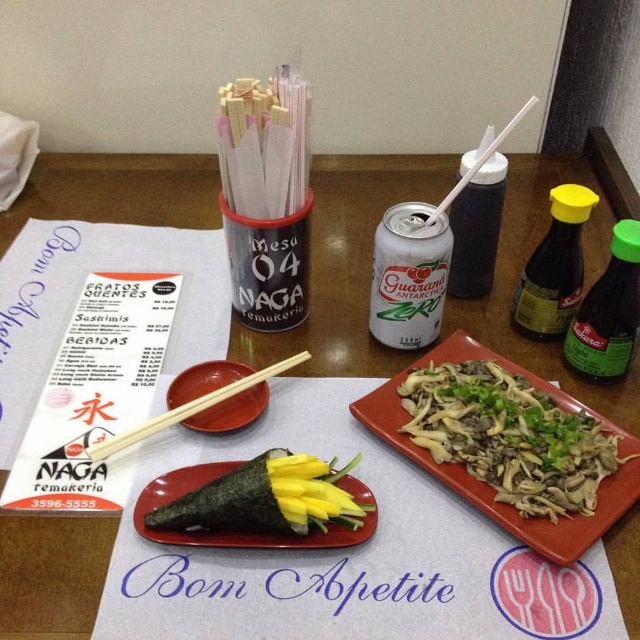
Question: Which object is the farthest from the white matte can at center?

Choices:
 (A) green glass soy sauce at right
 (B) matte wood chopsticks at center

Answer: (B)

Question: Observing the image, what is the correct spatial positioning of green leafy vegetables at center in reference to green glass soy sauce at right?

Choices:
 (A) right
 (B) left

Answer: (B)

Question: Estimate the real-world distances between objects in this image. Which object is closer to the white matte can at center?

Choices:
 (A) white plastic chopsticks at upper center
 (B) wooden chopsticks at center
 (C) matte wood chopsticks at center
 (D) green nori leaf at center

Answer: (A)

Question: Which point is farther to the camera?

Choices:
 (A) (148, 422)
 (B) (458, 248)

Answer: (B)

Question: Does black plastic bottle at right lie behind white plastic chopsticks at upper center?

Choices:
 (A) yes
 (B) no

Answer: (A)

Question: Can you confirm if green leafy vegetables at center is smaller than wooden chopsticks at center?

Choices:
 (A) no
 (B) yes

Answer: (A)